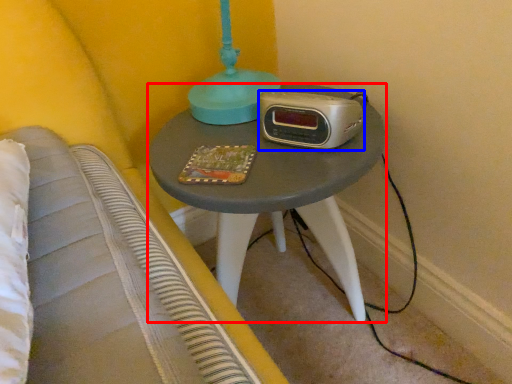
Question: Which of the following is the farthest to the observer, nightstand (highlighted by a red box) or stereo (highlighted by a blue box)?

Choices:
 (A) nightstand
 (B) stereo

Answer: (B)